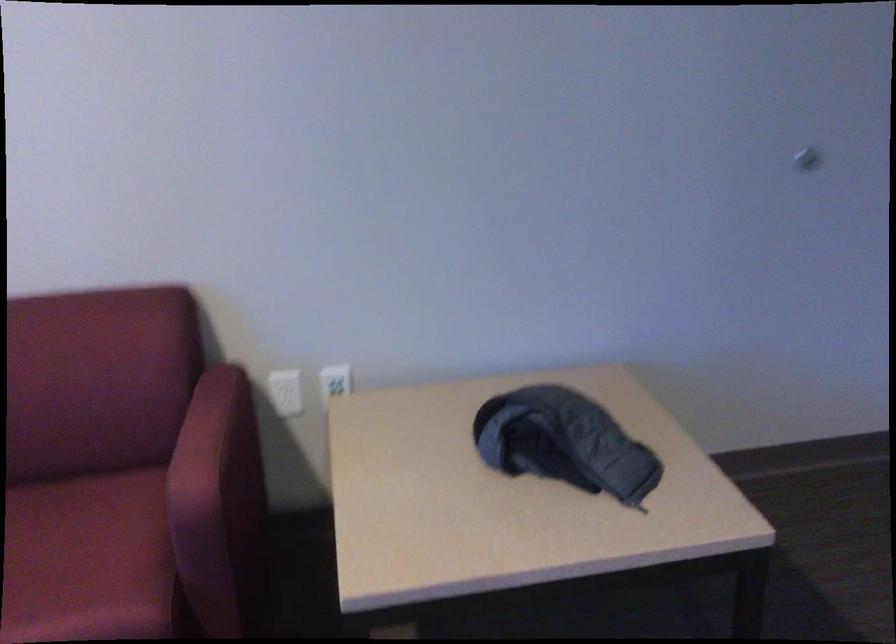
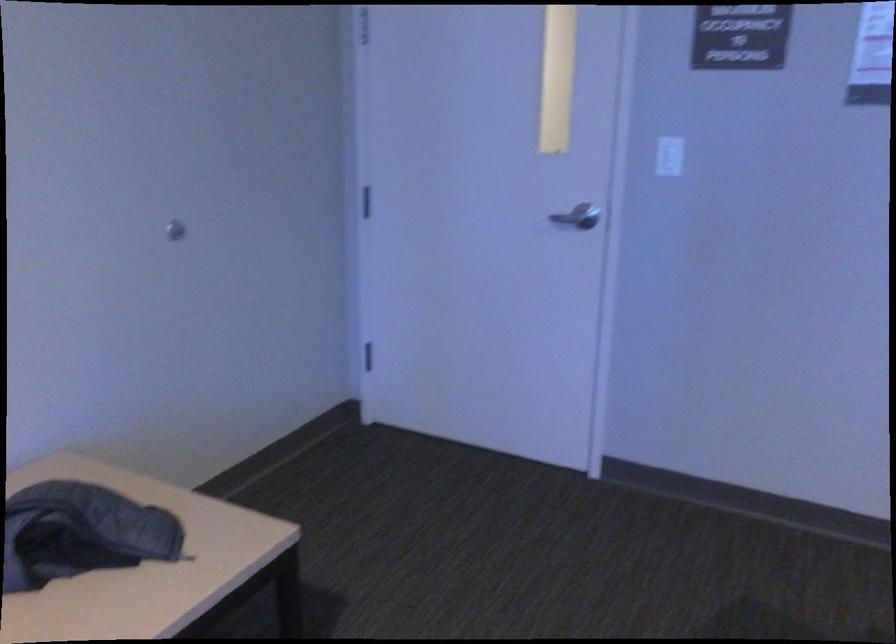
Question: The camera is either moving clockwise (left) or counter-clockwise (right) around the object. The first image is from the beginning of the video and the second image is from the end. Is the camera moving left or right when shooting the video?

Choices:
 (A) Left
 (B) Right

Answer: (A)